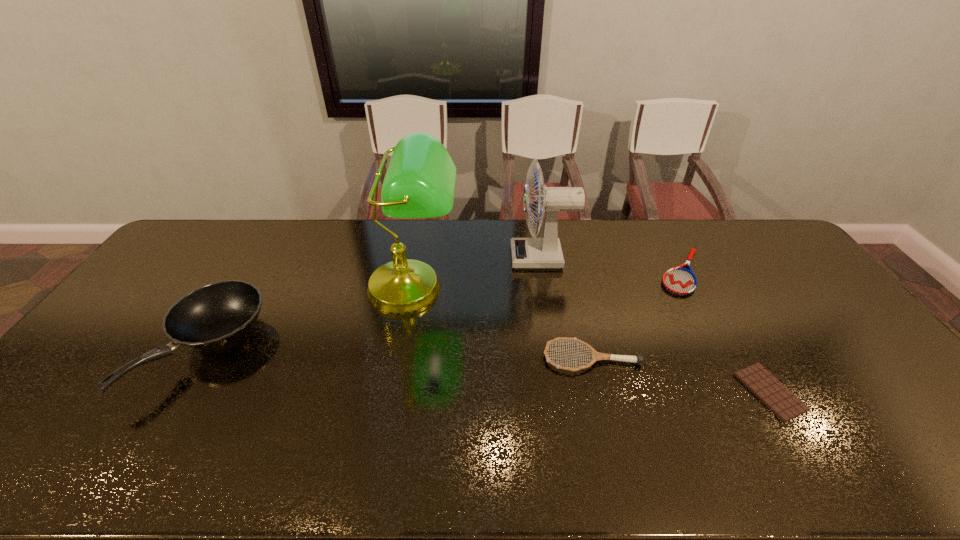
The image size is (960, 540). In order to click on vacant space situated 0.310m on the desk next to the tallest object in this screenshot , I will do `click(391, 423)`.

You are a GUI agent. You are given a task and a screenshot of the screen. Output one action in this format:
    pyautogui.click(x=<x>, y=<y>)
    Task: Click on the vacant space located 0.160m on the front-facing side of the fan
    This screenshot has height=540, width=960.
    Given the screenshot: What is the action you would take?
    pyautogui.click(x=466, y=258)

Locate an element on the screen. vacant space located 0.170m on the front-facing side of the fan is located at coordinates (463, 258).

The height and width of the screenshot is (540, 960). Find the location of `blank space located 0.100m on the front-facing side of the fan`. blank space located 0.100m on the front-facing side of the fan is located at coordinates (483, 258).

Find the location of a particular element. vacant region located 0.100m on the left of the frying pan is located at coordinates (119, 350).

Locate an element on the screen. The height and width of the screenshot is (540, 960). vacant region located 0.150m on the front of the nearer tennis racket is located at coordinates (608, 427).

Locate an element on the screen. blank space located on the back of the fifth tallest object is located at coordinates point(657,226).

Where is `vacant space situated on the front of the shortest object`? This screenshot has height=540, width=960. vacant space situated on the front of the shortest object is located at coordinates (817, 472).

Find the location of a particular element. Image resolution: width=960 pixels, height=540 pixels. lamp present at the far edge is located at coordinates (420, 180).

I want to click on fan at the far edge, so click(x=527, y=253).